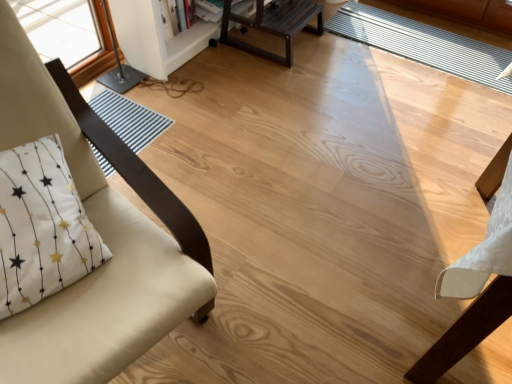
I want to click on vacant space to the right of dark brown wood table at upper center, so click(340, 56).